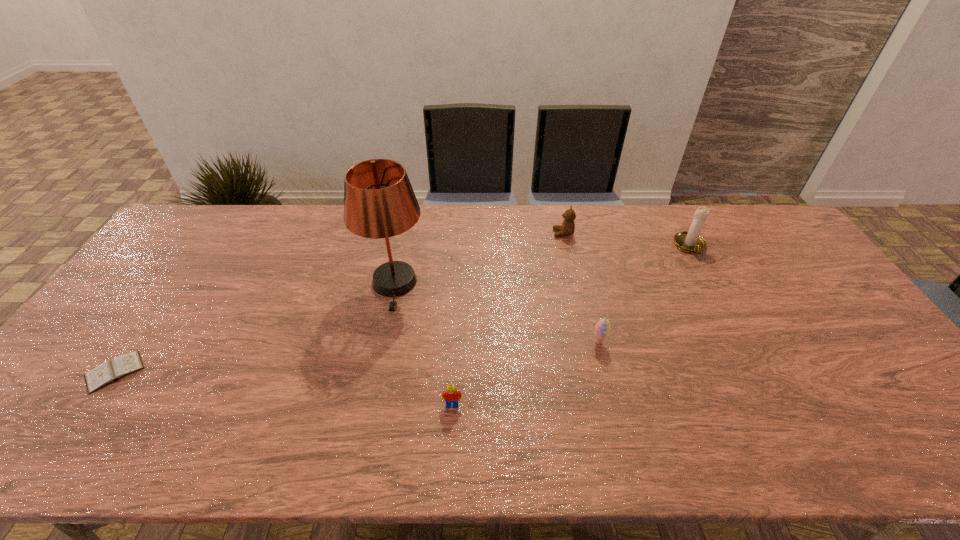
Where is `object located at the left edge`? This screenshot has height=540, width=960. object located at the left edge is located at coordinates (110, 371).

I want to click on vacant region at the far edge of the desktop, so tap(644, 214).

The width and height of the screenshot is (960, 540). In order to click on vacant area at the near edge in this screenshot , I will do `click(565, 448)`.

Locate an element on the screen. Image resolution: width=960 pixels, height=540 pixels. free region at the left edge of the desktop is located at coordinates (123, 312).

The image size is (960, 540). I want to click on vacant area that lies between the shortest object and the sherbert, so pos(356,357).

Locate an element on the screen. free spot between the third object from left to right and the fourth nearest object is located at coordinates (423, 344).

This screenshot has height=540, width=960. I want to click on vacant point located between the candle holder and the fourth farthest object, so click(x=644, y=294).

Locate an element on the screen. This screenshot has height=540, width=960. free space that is in between the fifth object from right to left and the sherbert is located at coordinates (496, 313).

Where is `vacant area between the sherbert and the teddy bear`? The width and height of the screenshot is (960, 540). vacant area between the sherbert and the teddy bear is located at coordinates (581, 288).

Identify the location of unoccupied area between the sherbert and the fifth farthest object. (356, 357).